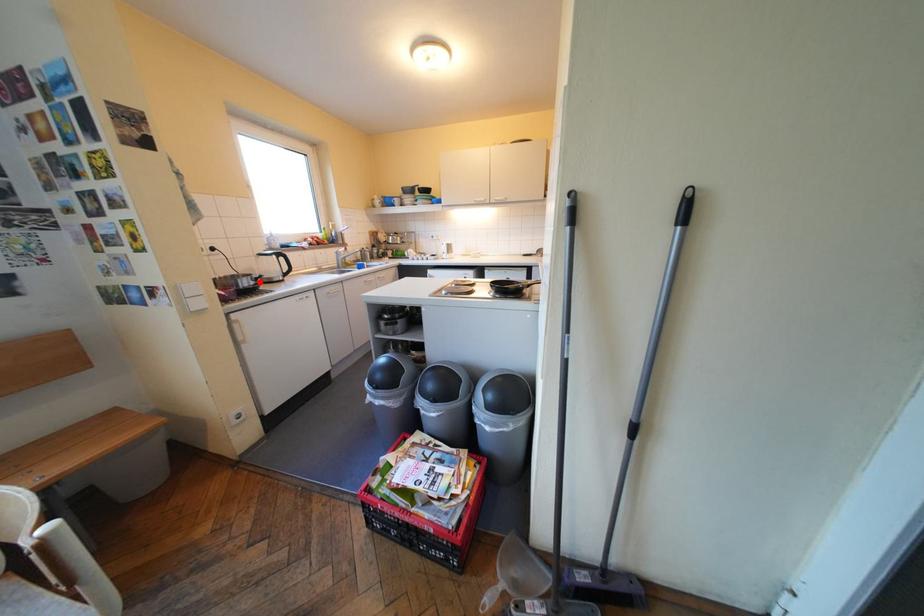
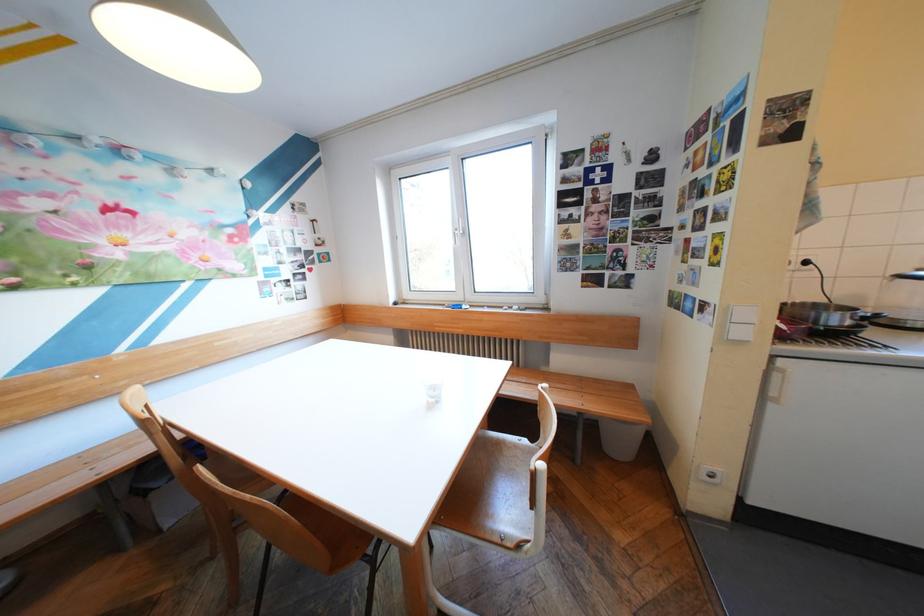
Locate, in the second image, the point that corresponds to the highlighted location in the first image.

(849, 318)